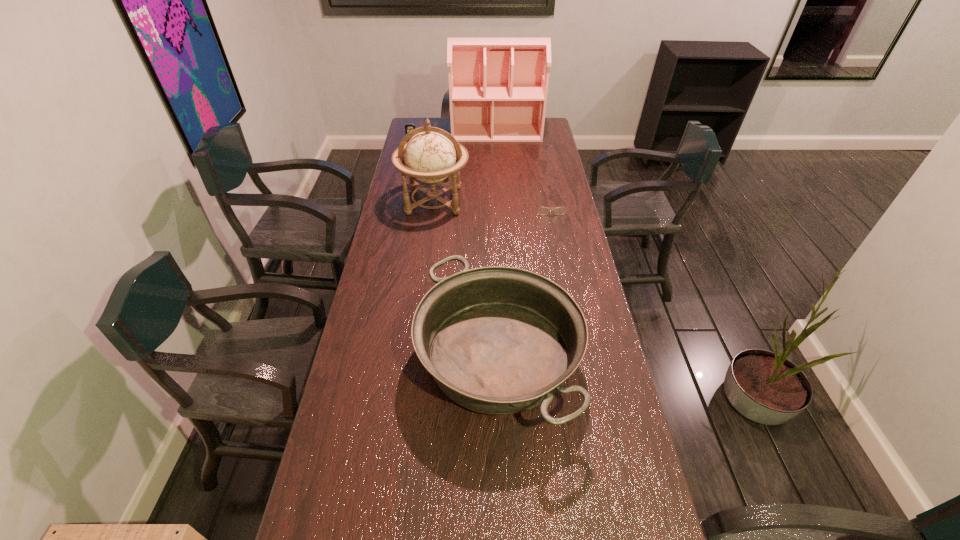
In the image, there is a desktop. In order to click on free space at the left edge in this screenshot , I will do `click(389, 356)`.

Identify the location of vacant space at the right edge of the desktop. (550, 222).

Where is `free area in between the tallest object and the third shortest object`? The image size is (960, 540). free area in between the tallest object and the third shortest object is located at coordinates (497, 245).

The image size is (960, 540). I want to click on empty space between the farthest object and the second tallest object, so click(466, 167).

The width and height of the screenshot is (960, 540). What are the coordinates of `free space between the fourth nearest object and the spectacles` in the screenshot? It's located at (481, 177).

Find the location of a particular element. vacant area that lies between the nearest object and the farthest object is located at coordinates (497, 245).

Locate an element on the screen. Image resolution: width=960 pixels, height=540 pixels. free point between the spectacles and the fourth tallest object is located at coordinates (481, 177).

You are a GUI agent. You are given a task and a screenshot of the screen. Output one action in this format:
    pyautogui.click(x=<x>, y=<y>)
    Task: Click on the vacant space that's between the nearest object and the second shortest object
    This screenshot has width=960, height=540.
    Given the screenshot: What is the action you would take?
    pyautogui.click(x=455, y=252)

Where is `free space between the tallest object and the pan`? free space between the tallest object and the pan is located at coordinates (497, 245).

Locate which object is the closest to the dollhouse. Please provide its 2D coordinates. Your answer should be formatted as a tuple, i.e. [(x, y)], where the tuple contains the x and y coordinates of a point satisfying the conditions above.

[(408, 127)]